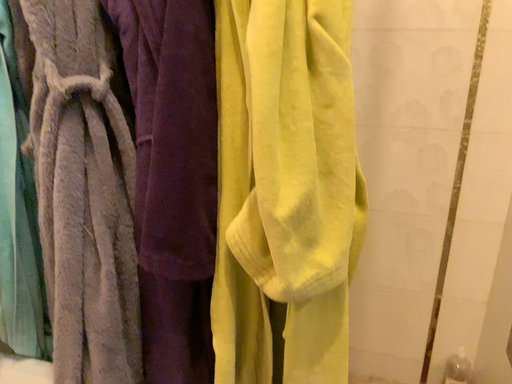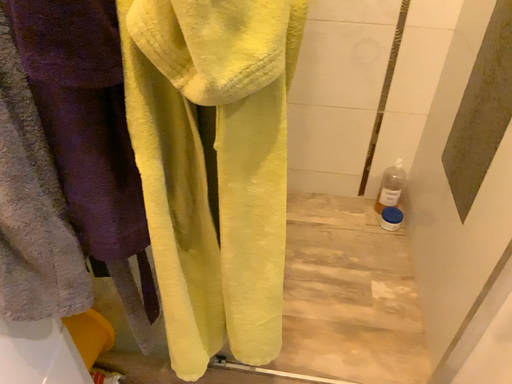
Question: Which way did the camera rotate in the video?

Choices:
 (A) rotated upward
 (B) rotated downward

Answer: (B)